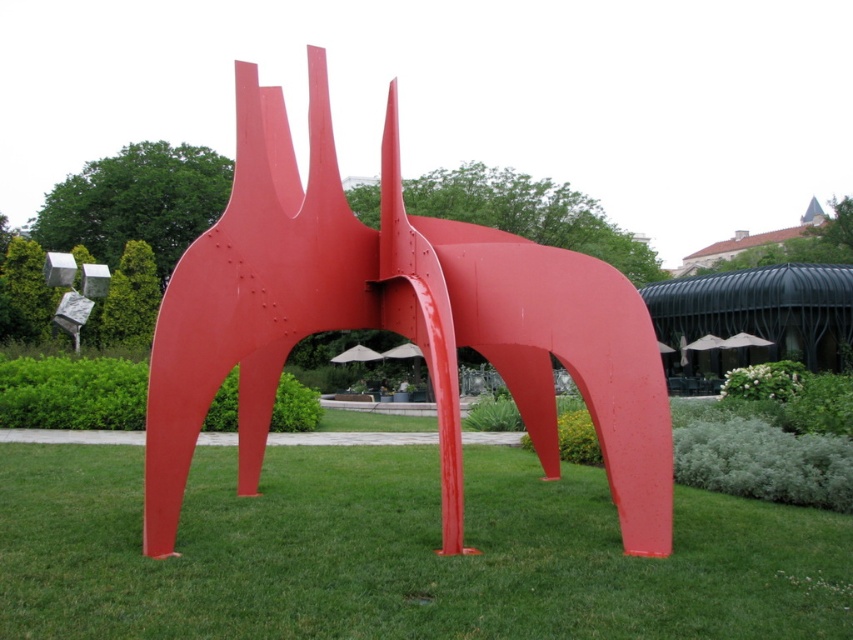
You are standing in the park and see the green grass at center and the glossy metal sculpture at center. Which object is located lower in the scene?

The green grass at center is located lower than the glossy metal sculpture at center as it is positioned below it.

You are standing at the origin point in the image, which is the bottom left corner. The sculpture is located at point 0.864, 0.468. You want to walk towards the sculpture. Which direction should you move relative to the green grass at center?

The green grass at center is located at point (398, 552), which is the same coordinates as the sculpture. Therefore, moving towards the sculpture means moving towards the green grass at center.

You are a gardener who needs to mow the green grass at center. To reach it, you must pass around the glossy metal sculpture at center. Based on their positions, which direction should you go around the sculpture to access the grass?

The green grass at center is positioned on the right side of the glossy metal sculpture at center, so you should go around the sculpture to the right to access the grass.